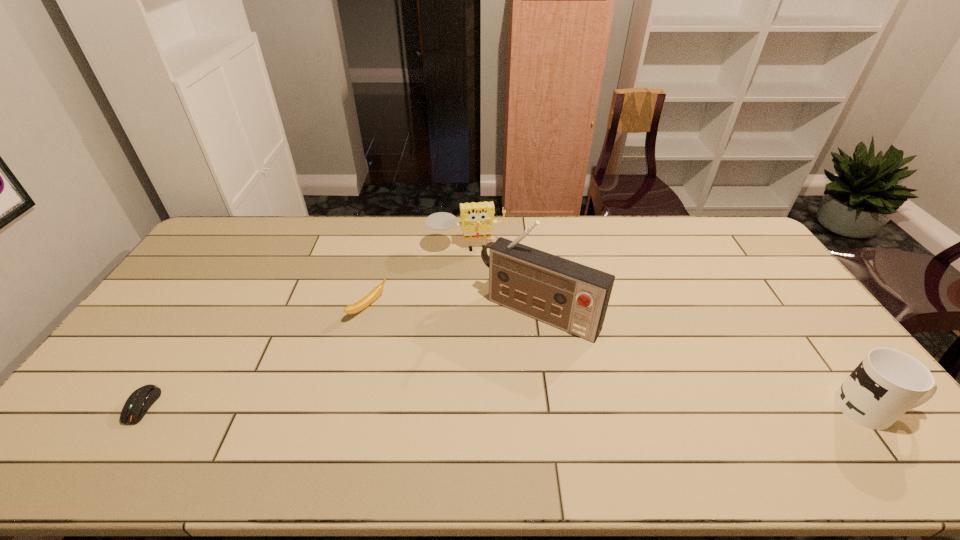
Find the location of `vacant spot on the desktop that is between the computer equipment and the mug and is positioned at the stem of the second shortest object`. vacant spot on the desktop that is between the computer equipment and the mug and is positioned at the stem of the second shortest object is located at coordinates (568, 407).

I want to click on free space on the desktop that is between the leftmost object and the rightmost object and is positioned on the front-facing side of the farthest object, so click(490, 407).

The width and height of the screenshot is (960, 540). Identify the location of vacant space on the desktop that is between the shortest object and the rightmost object and is positioned on the front panel of the radio receiver. (476, 407).